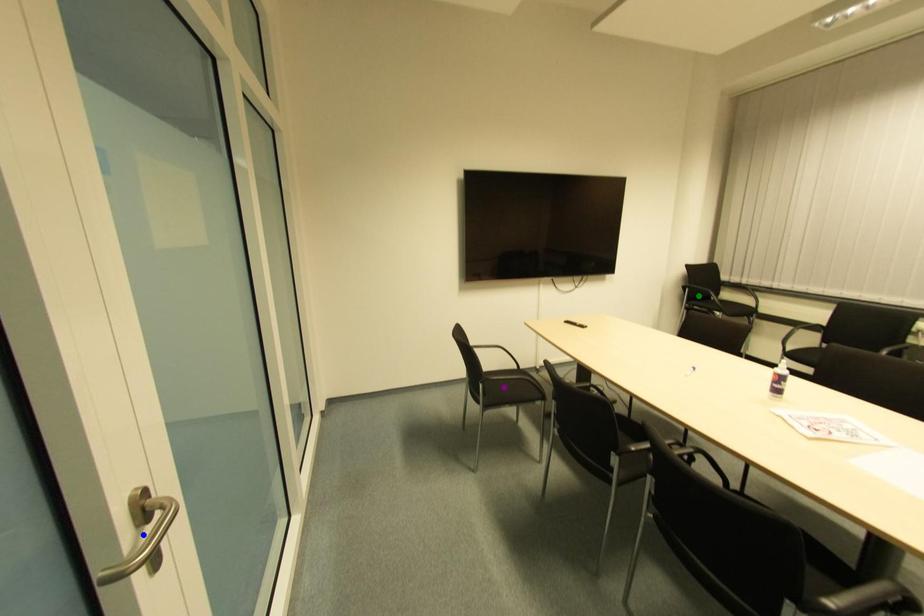
Order these from nearest to farthest:
1. blue point
2. purple point
3. green point

blue point, purple point, green point